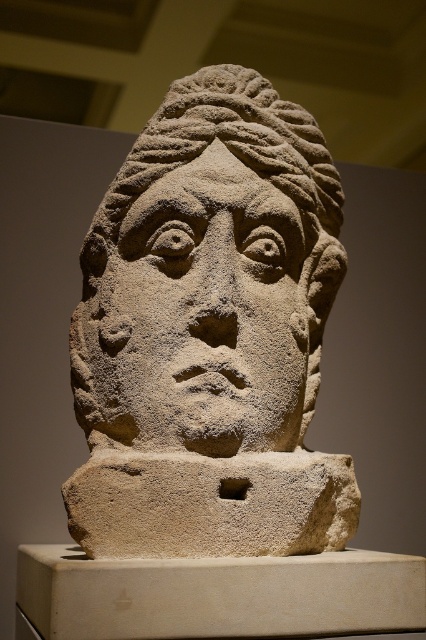
Question: Can you confirm if sandstone head at center is positioned to the right of stone textured face at center?

Choices:
 (A) yes
 (B) no

Answer: (A)

Question: Is sandstone head at center above stone textured face at center?

Choices:
 (A) yes
 (B) no

Answer: (A)

Question: Which point is farther to the camera?

Choices:
 (A) (229, 326)
 (B) (140, 445)

Answer: (A)

Question: Which of the following is the farthest from the observer?

Choices:
 (A) (233, 236)
 (B) (129, 230)

Answer: (B)

Question: Can you confirm if sandstone head at center is positioned to the left of stone textured face at center?

Choices:
 (A) yes
 (B) no

Answer: (B)